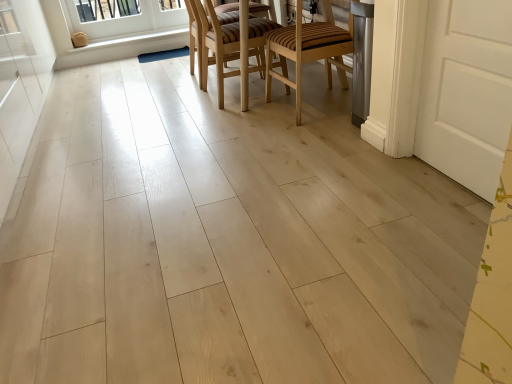
You are a GUI agent. You are given a task and a screenshot of the screen. Output one action in this format:
    pyautogui.click(x=<x>, y=<y>)
    Task: Click on the vacant space in front of wooden chair at center, which is the 2th chair from right to left
    This screenshot has height=384, width=512.
    Given the screenshot: What is the action you would take?
    pyautogui.click(x=227, y=117)